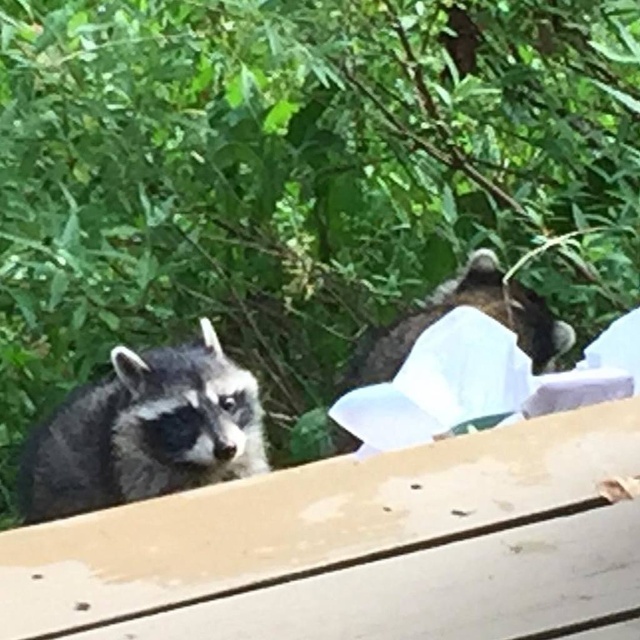
Is gray fur raccoon at left further to the viewer compared to dark gray fur raccoon at center?

No, it is in front of dark gray fur raccoon at center.

Does gray fur raccoon at left appear on the right side of dark gray fur raccoon at center?

No, gray fur raccoon at left is not to the right of dark gray fur raccoon at center.

Does point (42, 465) come behind point (515, 321)?

No, it is in front of (515, 321).

The width and height of the screenshot is (640, 640). Find the location of `gray fur raccoon at left`. gray fur raccoon at left is located at coordinates (145, 432).